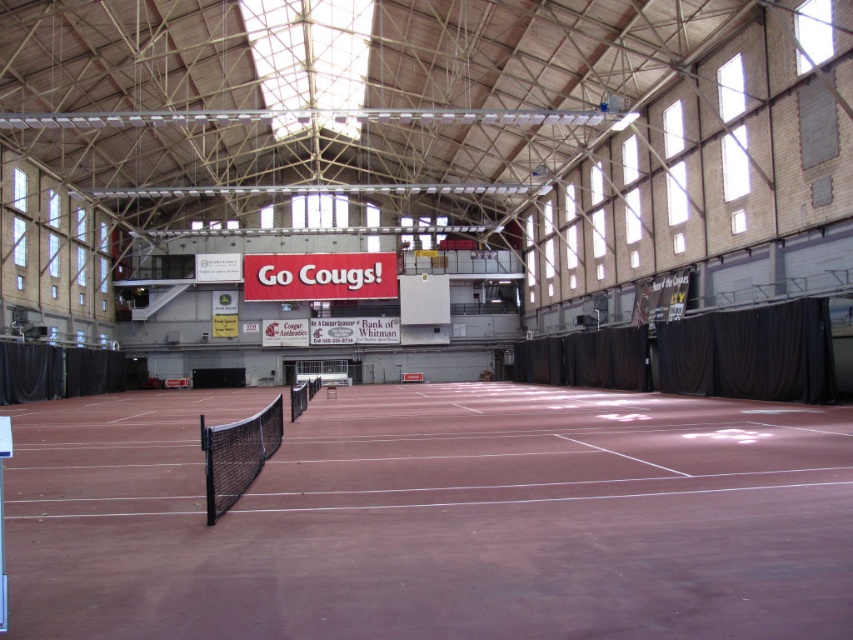
You are a tennis player standing at the baseline of the brown clay tennis court at center. You want to hit a ball over the black mesh net at center. Based on their positions, can you see the entire net from your current position?

The brown clay tennis court at center is in front of the black mesh net at center, so when standing at the baseline, you are positioned behind the net. This means you can see the entire net from your current position.

You are a tennis instructor preparing to set up equipment for a lesson. You have a new black mesh net at center that needs to be placed on the brown clay tennis court at center. Can you confirm if the net will fit entirely on the court without overhanging?

The brown clay tennis court at center is bigger than the black mesh net at center, so yes, the net will fit entirely on the court without overhanging.